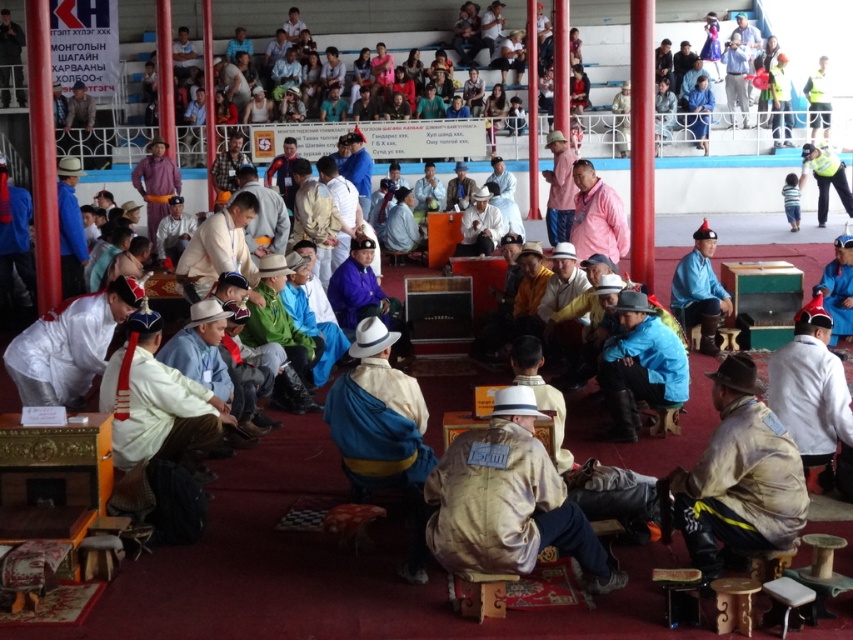
Is white cotton shirt at center to the right of matte blue jacket at left from the viewer's perspective?

Indeed, white cotton shirt at center is positioned on the right side of matte blue jacket at left.

Does point (190, 282) come in front of point (67, 193)?

That is True.

Does point (248, 296) come behind point (68, 195)?

That is False.

The width and height of the screenshot is (853, 640). What are the coordinates of `white cotton shirt at center` in the screenshot? It's located at tap(218, 248).

Does point (517, 545) come in front of point (689, 308)?

Yes, point (517, 545) is closer to viewer.

You are a GUI agent. You are given a task and a screenshot of the screen. Output one action in this format:
    pyautogui.click(x=<x>, y=<y>)
    Task: Click on the tan suede jacket at center
    
    Given the screenshot: What is the action you would take?
    pyautogui.click(x=508, y=500)

This screenshot has width=853, height=640. I want to click on tan suede jacket at center, so click(x=508, y=500).

Between matte blue jacket at left and white felt hat at center, which one is positioned lower?

matte blue jacket at left

Which is in front, point (73, 266) or point (465, 211)?

Point (73, 266) is more forward.

Between point (64, 177) and point (489, 243), which one is positioned in front?

Point (64, 177) is more forward.

Find the location of `matte blue jacket at left`. matte blue jacket at left is located at coordinates (70, 228).